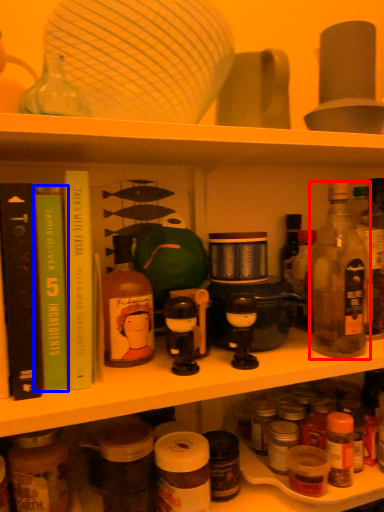
Question: Which object is further to the camera taking this photo, bottle (highlighted by a red box) or book (highlighted by a blue box)?

Choices:
 (A) bottle
 (B) book

Answer: (A)